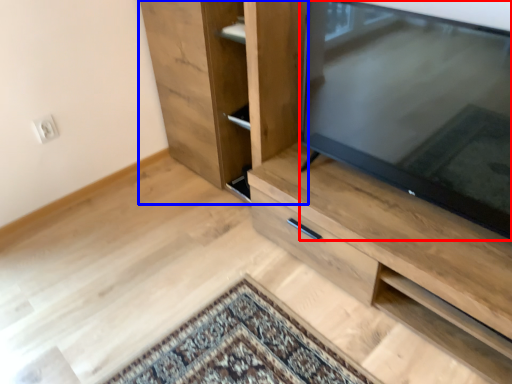
Question: Which point is closer to the camera, television (highlighted by a red box) or cupboard (highlighted by a blue box)?

Choices:
 (A) television
 (B) cupboard

Answer: (A)